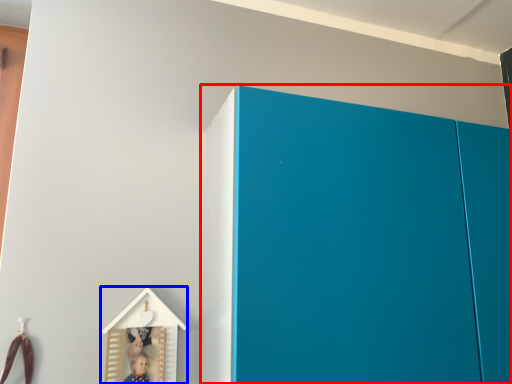
Question: Which object is closer to the camera taking this photo, cupboard (highlighted by a red box) or toy (highlighted by a blue box)?

Choices:
 (A) cupboard
 (B) toy

Answer: (A)